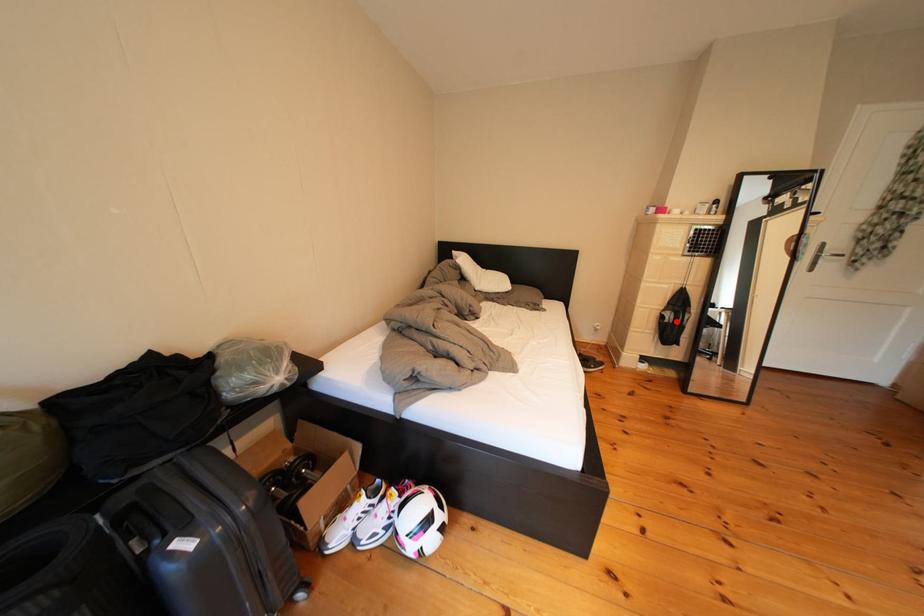
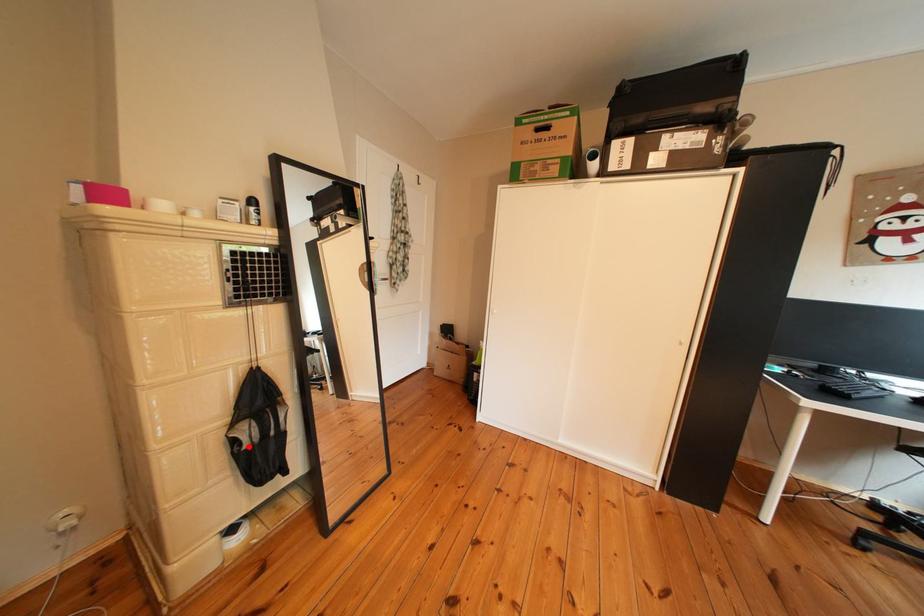
I am providing you with two images of the same scene from different viewpoints. A red point is marked on the first image and another point is marked on the second image. Do the highlighted points in image1 and image2 indicate the same real-world spot?

Yes